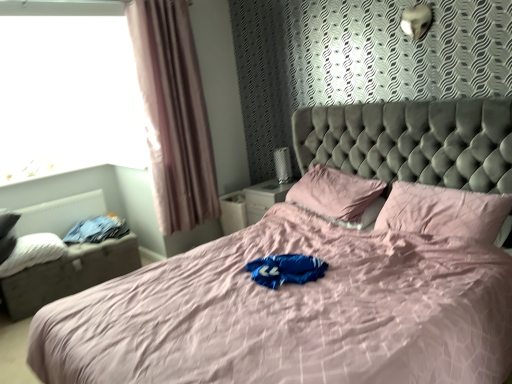
What are the coordinates of `vacant area on top of white textured radiator at left (from a real-world perspective)` in the screenshot? It's located at (52, 200).